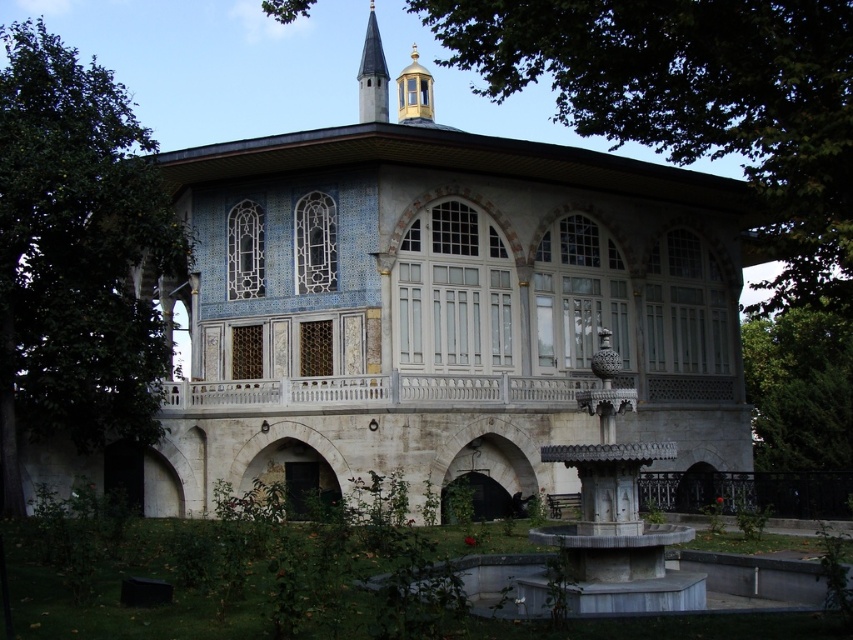
Does white stone building at center appear on the right side of smooth white spire at upper center?

Yes, white stone building at center is to the right of smooth white spire at upper center.

In the scene shown: Is white stone building at center taller than smooth white spire at upper center?

Indeed, white stone building at center has a greater height compared to smooth white spire at upper center.

This screenshot has height=640, width=853. Describe the element at coordinates (440, 305) in the screenshot. I see `white stone building at center` at that location.

Locate an element on the screen. Image resolution: width=853 pixels, height=640 pixels. white stone building at center is located at coordinates (440, 305).

Which is more to the left, green leafy tree at left or green leafy tree at right?

From the viewer's perspective, green leafy tree at left appears more on the left side.

Who is shorter, green leafy tree at left or green leafy tree at right?

Standing shorter between the two is green leafy tree at right.

Who is more forward, (120, 241) or (775, 432)?

Positioned in front is point (120, 241).

You are a GUI agent. You are given a task and a screenshot of the screen. Output one action in this format:
    pyautogui.click(x=<x>, y=<y>)
    Task: Click on the green leafy tree at left
    This screenshot has width=853, height=640.
    Given the screenshot: What is the action you would take?
    pyautogui.click(x=76, y=253)

Can you confirm if white stone building at center is shorter than green leafy tree at left?

Correct, white stone building at center is not as tall as green leafy tree at left.

The height and width of the screenshot is (640, 853). Describe the element at coordinates (440, 305) in the screenshot. I see `white stone building at center` at that location.

Where is `white stone building at center`? The height and width of the screenshot is (640, 853). white stone building at center is located at coordinates (440, 305).